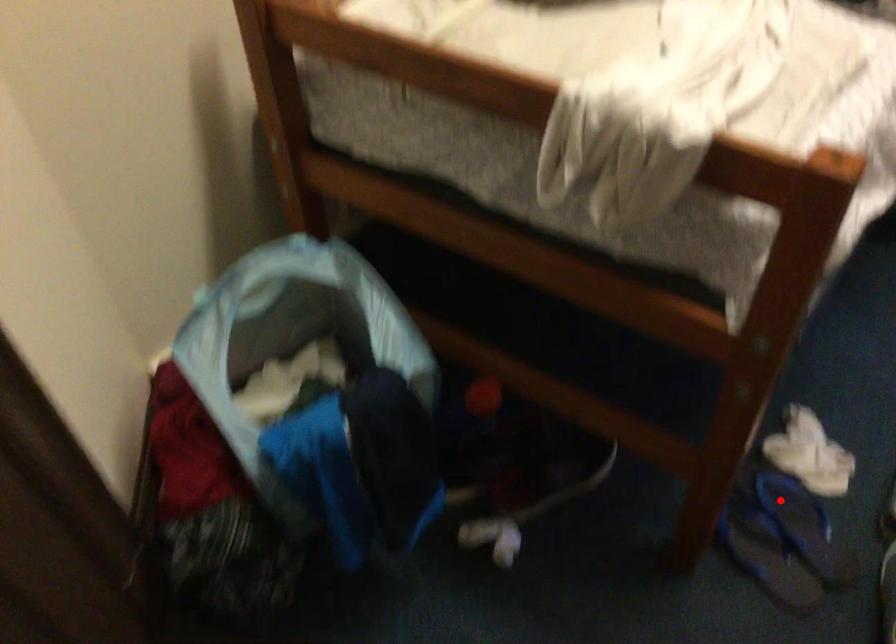
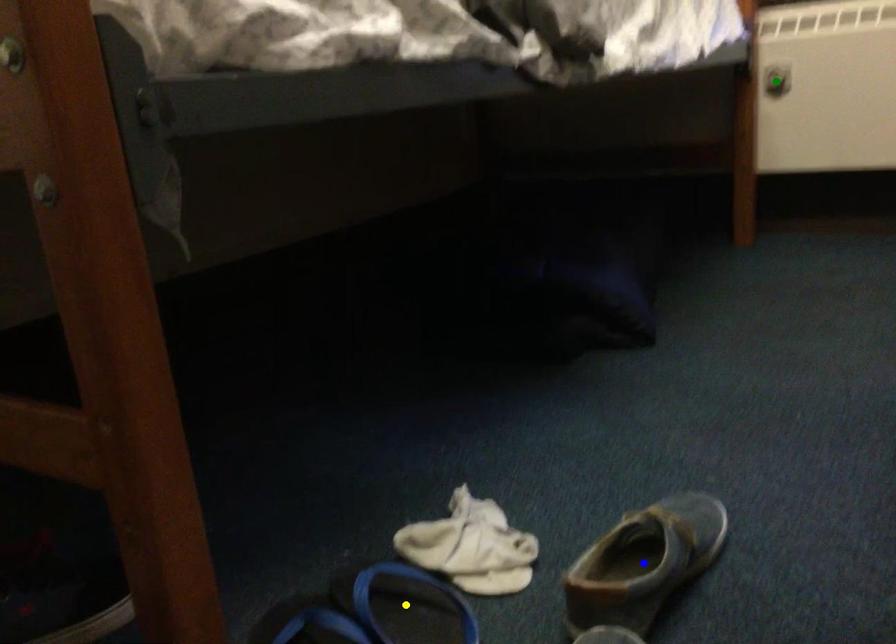
Question: I am providing you with two images of the same scene from different viewpoints. A red point is marked on the first image. You are given multiple points on the second image. Which mark in image 2 goes with the point in image 1?

Choices:
 (A) yellow point
 (B) green point
 (C) blue point

Answer: (A)